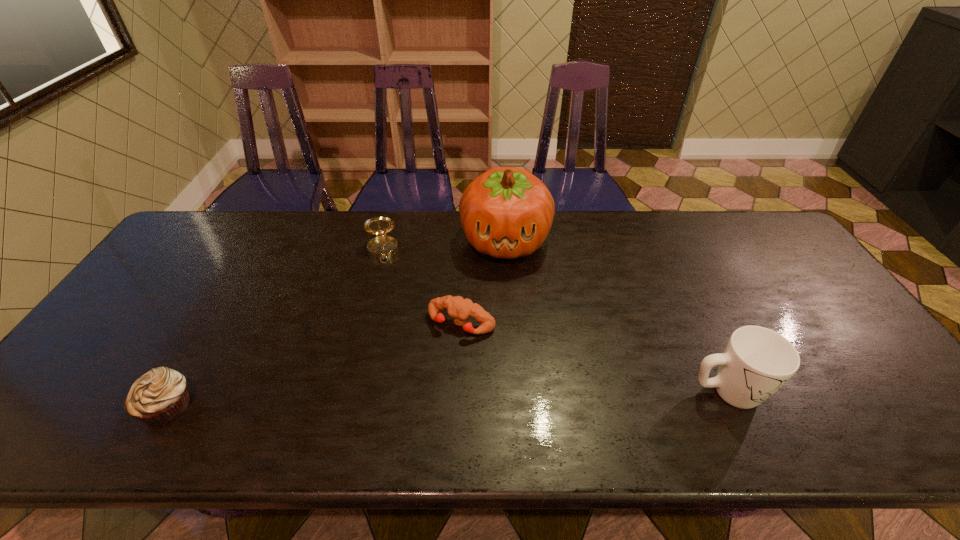
Where is `the fourth tallest object`? the fourth tallest object is located at coordinates (160, 396).

The image size is (960, 540). I want to click on the leftmost object, so click(x=160, y=396).

I want to click on the fourth shortest object, so click(757, 362).

This screenshot has width=960, height=540. Identify the location of the rightmost object. (757, 362).

I want to click on the shortest object, so click(x=460, y=309).

You are a GUI agent. You are given a task and a screenshot of the screen. Output one action in this format:
    pyautogui.click(x=<x>, y=<y>)
    Task: Click on the puncher
    
    Given the screenshot: What is the action you would take?
    pyautogui.click(x=460, y=309)

The width and height of the screenshot is (960, 540). What are the coordinates of `compass` in the screenshot? It's located at click(x=382, y=247).

Where is `the second object from left to right`? the second object from left to right is located at coordinates (382, 247).

Find the location of a particular element. The image size is (960, 540). the tallest object is located at coordinates pyautogui.click(x=507, y=212).

Locate an element on the screen. free space located 0.050m on the right of the muffin is located at coordinates (216, 406).